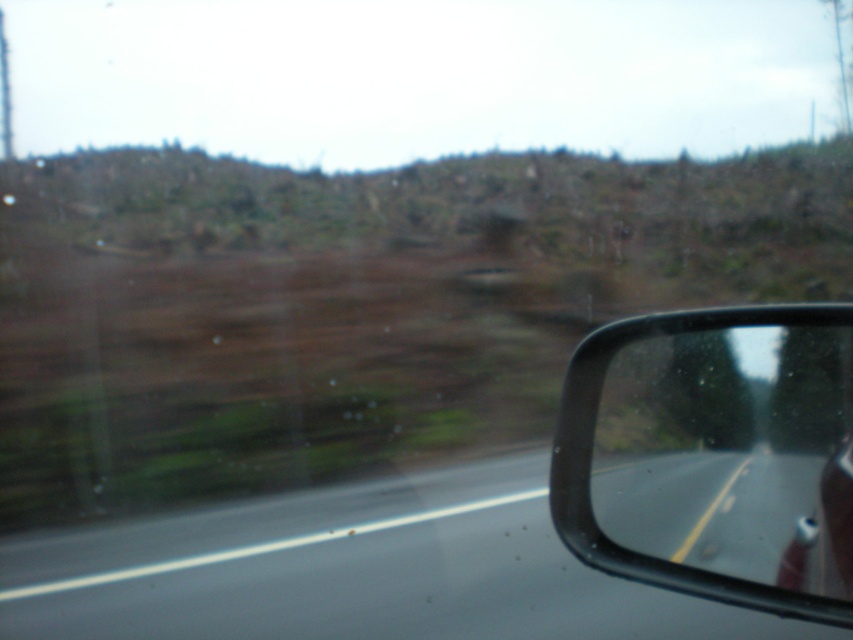
You are driving a car and need to check your blind spot using the black plastic mirror at right while staying on the smooth asphalt road at center. Can you safely check the mirror without leaving the road?

The smooth asphalt road at center and black plastic mirror at right are 15.59 feet apart. Since the distance between them is sufficient, you can safely check the mirror without leaving the road.

You are a driver checking your side mirrors to ensure safety before changing lanes. You notice the smooth asphalt road at center and the black plastic mirror at right. Which object is located to the right of the other?

The smooth asphalt road at center is positioned on the left side of black plastic mirror at right, so the black plastic mirror at right is to the right of the smooth asphalt road at center.

You are a driver checking your vehicle mirrors. You notice the smooth asphalt road at center and the black plastic mirror at right. Which object appears closer to you based on their heights in the image?

The smooth asphalt road at center appears closer because it has a lesser height compared to the black plastic mirror at right, indicating it is nearer to the observer.